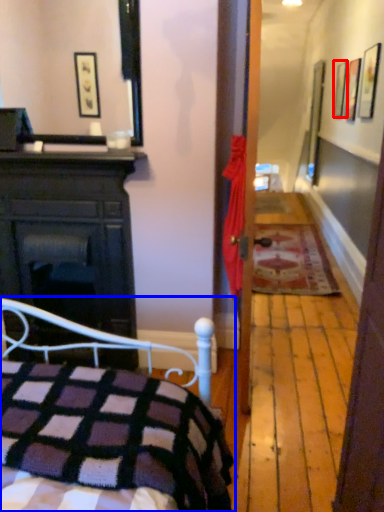
Question: Among these objects, which one is farthest to the camera, picture frame (highlighted by a red box) or bed (highlighted by a blue box)?

Choices:
 (A) picture frame
 (B) bed

Answer: (A)